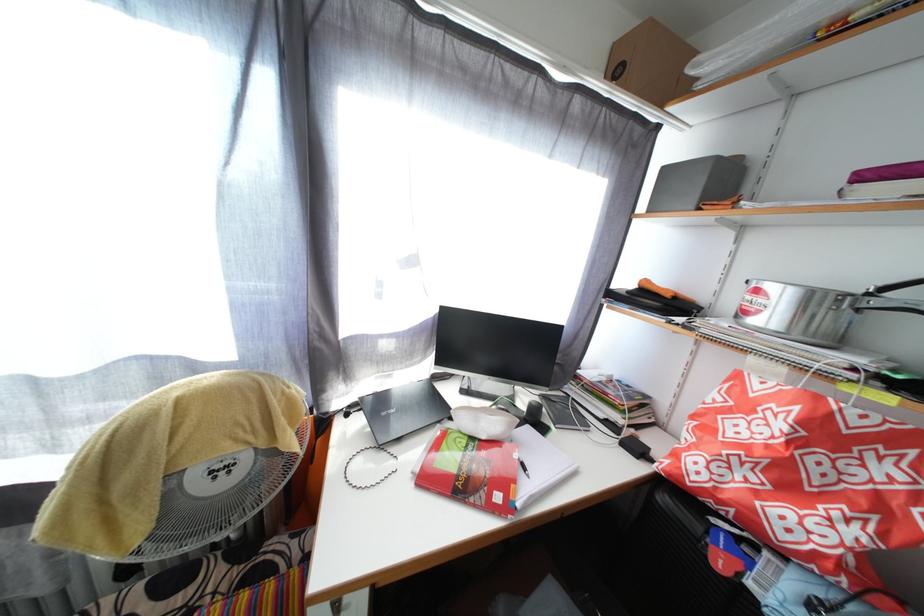
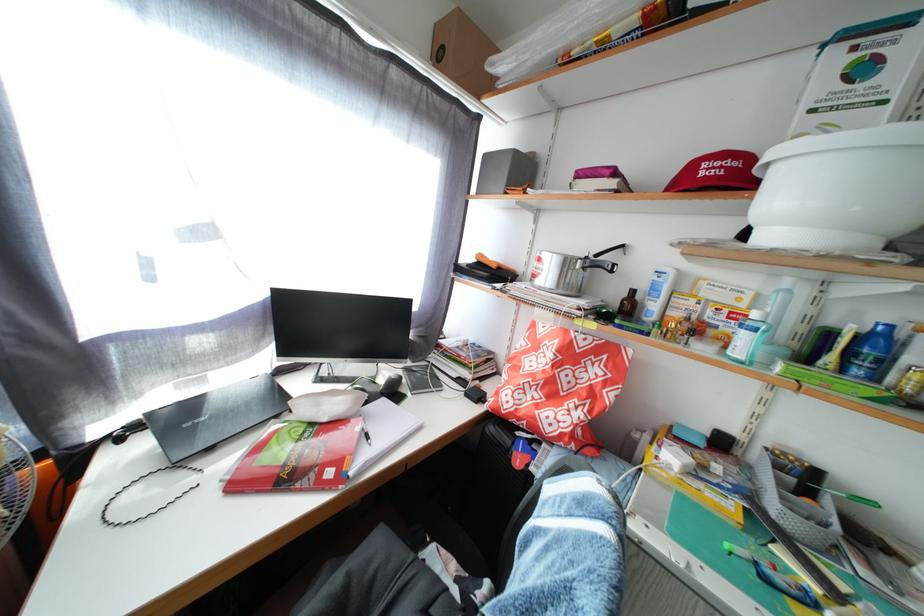
Where in the second image is the point corresponding to (x=506, y=504) from the first image?

(338, 480)